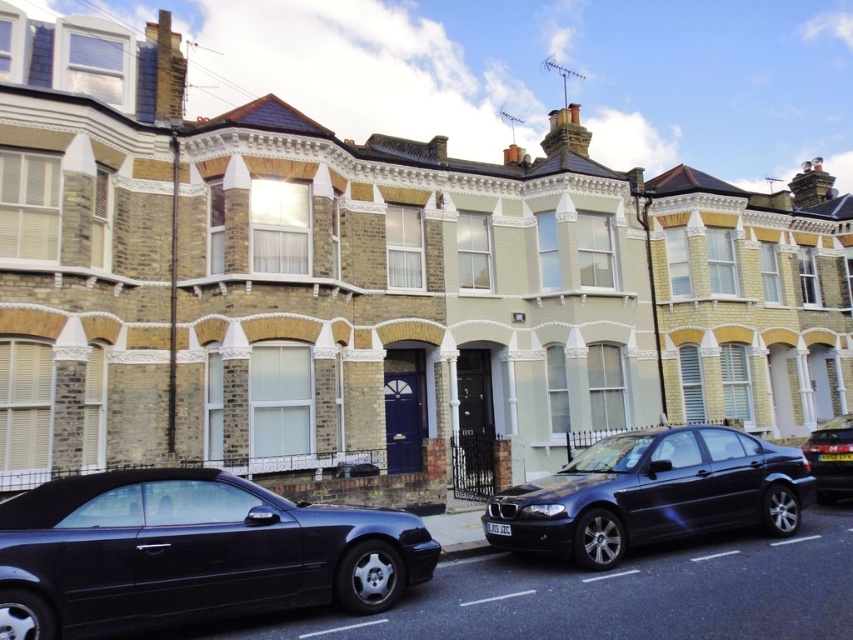
You are standing on the sidewalk in front of the row of terraced houses and want to cross the street to reach the shiny black convertible at lower left. If the road is 6 meters wide, can you safely cross without stepping into the road?

The distance between you and the shiny black convertible at lower left is 5.91 meters, which is less than the road width of 6 meters. Therefore, you can safely cross the street to reach the shiny black convertible at lower left without stepping into the road.

Looking at this image, you are a delivery person trying to park a new vehicle between the two sedans at the center of the street. The new vehicle is the same size as the glossy black sedan at center. Will it fit between them if the space between the two sedans is exactly the size needed for the shiny black sedan at center?

The glossy black sedan at center is larger in size than the shiny black sedan at center. Since the new vehicle is the same size as the glossy black sedan at center, it would require more space than what is available between the two sedans. Therefore, it will not fit.

Consider the image. You are a delivery person trying to park a new vehicle between the shiny black convertible at lower left and the glossy black sedan at center. Can you fit a standard delivery van that is 2 meters wide into the space between them?

The shiny black convertible at lower left has a smaller size compared to glossy black sedan at center. However, the exact distance between them isn not specified in the objects description. Therefore, it is impossible to determine if the 2 meter wide delivery van can fit between them based on the provided information.